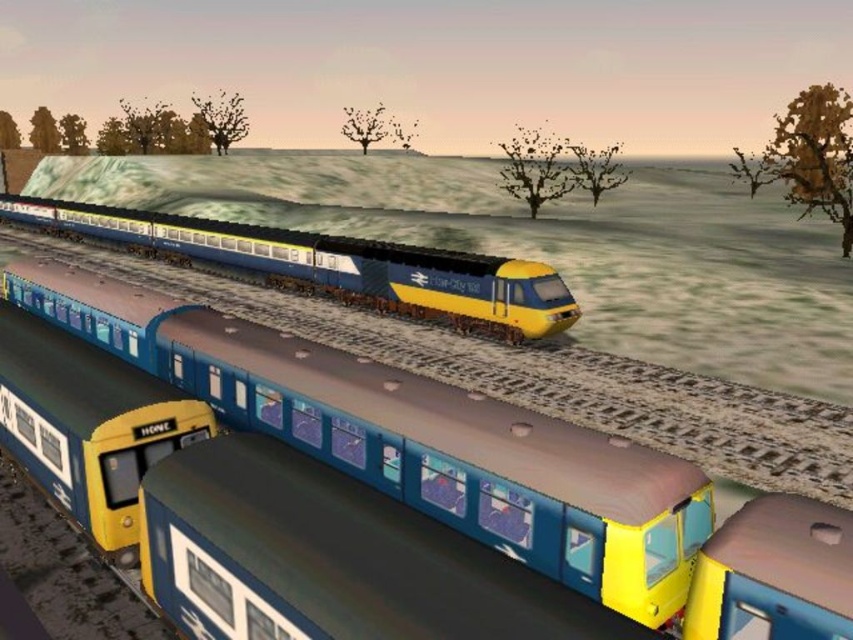
Question: Which point is closer to the camera?

Choices:
 (A) (669, 579)
 (B) (553, 298)

Answer: (A)

Question: Does metallic blue train at center appear under blue glossy train at center?

Choices:
 (A) no
 (B) yes

Answer: (B)

Question: Which of the following is the closest to the observer?

Choices:
 (A) (540, 305)
 (B) (358, 397)

Answer: (B)

Question: Is metallic blue train at center closer to the viewer compared to blue glossy train at center?

Choices:
 (A) yes
 (B) no

Answer: (A)

Question: Can you confirm if metallic blue train at center is smaller than blue glossy train at center?

Choices:
 (A) no
 (B) yes

Answer: (B)